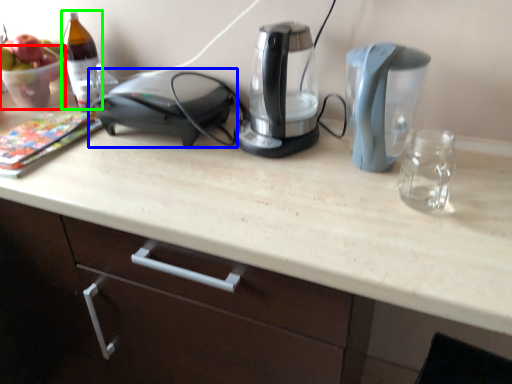
Question: Which is nearer to the glass bowl (highlighted by a red box)? home appliance (highlighted by a blue box) or wine bottle (highlighted by a green box).

Choices:
 (A) home appliance
 (B) wine bottle

Answer: (B)